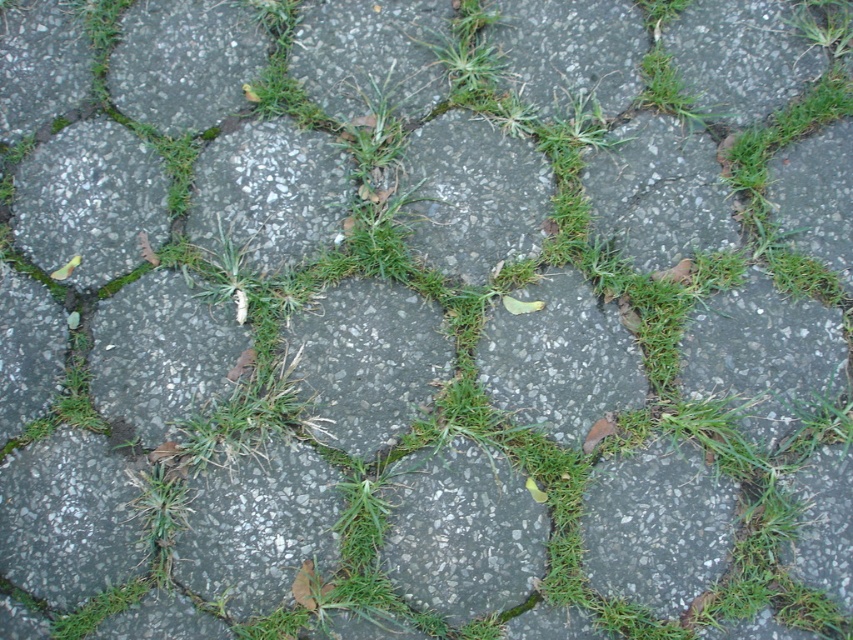
You are standing on the paved surface and want to place a 2.0 meter long ladder horizontally so that it touches the gray concrete stone at center. Is this possible?

The gray concrete stone at center is 1.96 meters from the viewer. Since the ladder is 2.0 meters long, it can just barely reach the stone if placed horizontally, but there might be a slight gap due to the difference in length.

You are standing 10 feet away from the camera position. You want to place a 3.5 feet long wooden plank from your current position to the gray concrete stone at center. Is the plank long enough to reach the stone?

The gray concrete stone at center is 6.44 feet away from the camera. Since you are standing 10 feet away from the camera, the total distance between you and the stone is 10 feet plus 6.44 feet, which equals 16.44 feet. The plank is only 3.5 feet long, so it is not long enough to reach the stone.